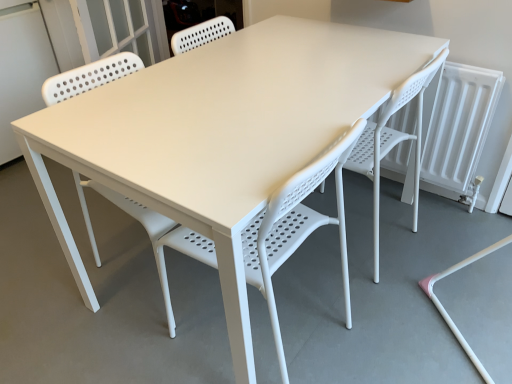
Question: From their relative heights in the image, would you say white plastic chair at center, which is counted as the 1th chair, starting from the right, is taller or shorter than white plastic chair at center, which appears as the second chair when viewed from the right?

Choices:
 (A) short
 (B) tall

Answer: (B)

Question: Considering the positions of point (365, 152) and point (275, 342), is point (365, 152) closer or farther from the camera than point (275, 342)?

Choices:
 (A) closer
 (B) farther

Answer: (B)

Question: Estimate the real-world distances between objects in this image. Which object is closer to the white plastic chair at center, the 1th chair positioned from the left?

Choices:
 (A) white plastic chair at center, which appears as the second chair when viewed from the left
 (B) white plastic screen door at upper left

Answer: (A)

Question: Estimate the real-world distances between objects in this image. Which object is farther from the white plastic screen door at upper left?

Choices:
 (A) white plastic chair at center, which appears as the second chair when viewed from the right
 (B) white plastic chair at center, which is counted as the 1th chair, starting from the right

Answer: (B)